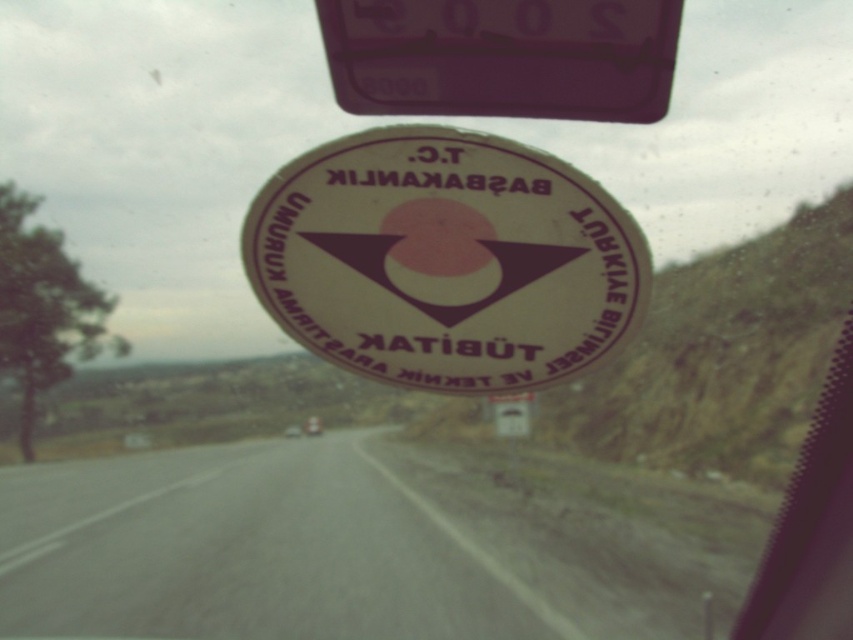
Between point (503, 340) and point (386, 81), which one is positioned in front?

Point (503, 340) is in front.

Is white glossy sticker at center bigger than purple glossy traffic sign at upper center?

Indeed, white glossy sticker at center has a larger size compared to purple glossy traffic sign at upper center.

Find the location of a particular element. This screenshot has height=640, width=853. white glossy sticker at center is located at coordinates (445, 260).

Consider the image. Does gray asphalt road at center come in front of purple glossy traffic sign at upper center?

No, gray asphalt road at center is further to the viewer.

Can you confirm if gray asphalt road at center is wider than purple glossy traffic sign at upper center?

Indeed, gray asphalt road at center has a greater width compared to purple glossy traffic sign at upper center.

This screenshot has width=853, height=640. What do you see at coordinates (248, 550) in the screenshot?
I see `gray asphalt road at center` at bounding box center [248, 550].

Identify the location of gray asphalt road at center. The width and height of the screenshot is (853, 640). (248, 550).

Which of these two, gray asphalt road at center or white glossy sticker at center, stands shorter?

Answer: Standing shorter between the two is white glossy sticker at center.

Between gray asphalt road at center and white glossy sticker at center, which one is positioned lower?

Positioned lower is gray asphalt road at center.

What do you see at coordinates (248, 550) in the screenshot? I see `gray asphalt road at center` at bounding box center [248, 550].

What are the coordinates of `gray asphalt road at center` in the screenshot? It's located at (248, 550).